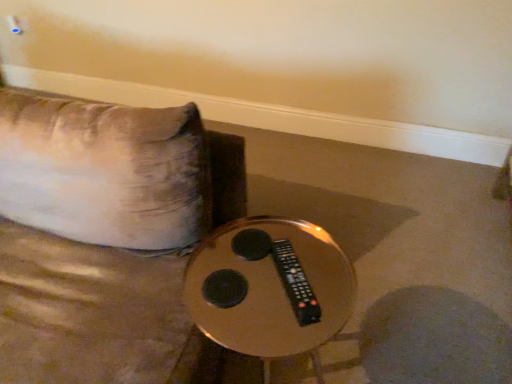
In order to face metallic gold table at center, should I rotate leftwards or rightwards?

Rotate your view right by about 1.647°.

What do you see at coordinates (271, 290) in the screenshot? I see `metallic gold table at center` at bounding box center [271, 290].

Image resolution: width=512 pixels, height=384 pixels. What are the coordinates of `metallic gold table at center` in the screenshot? It's located at (271, 290).

Identify the location of black plastic remote at center. (295, 283).

Describe the element at coordinates (295, 283) in the screenshot. I see `black plastic remote at center` at that location.

Where is `metallic gold table at center`? This screenshot has height=384, width=512. metallic gold table at center is located at coordinates (271, 290).

Which object is positioned more to the right, black plastic remote at center or metallic gold table at center?

black plastic remote at center is more to the right.

Does black plastic remote at center come in front of metallic gold table at center?

No, black plastic remote at center is further to the viewer.

Consider the image. Which is less distant, (291, 253) or (200, 251)?

Point (291, 253) appears to be closer to the viewer than point (200, 251).

From the image's perspective, is black plastic remote at center beneath metallic gold table at center?

No, from the image's perspective, black plastic remote at center is not beneath metallic gold table at center.

From a real-world perspective, is black plastic remote at center below metallic gold table at center?

Actually, black plastic remote at center is physically above metallic gold table at center in the real world.

Considering the sizes of objects black plastic remote at center and metallic gold table at center in the image provided, who is wider, black plastic remote at center or metallic gold table at center?

metallic gold table at center is wider.

Which of these two, black plastic remote at center or metallic gold table at center, stands shorter?

With less height is black plastic remote at center.

Based on their sizes in the image, would you say black plastic remote at center is bigger or smaller than metallic gold table at center?

black plastic remote at center is smaller than metallic gold table at center.

Which is correct: black plastic remote at center is inside metallic gold table at center, or outside of it?

The correct answer is: inside.

Does black plastic remote at center touch metallic gold table at center?

Yes, black plastic remote at center is with metallic gold table at center.

Could you tell me if black plastic remote at center is facing metallic gold table at center?

No.

Measure the distance from black plastic remote at center to metallic gold table at center.

A distance of 3.24 inches exists between black plastic remote at center and metallic gold table at center.

In order to click on remote that appears above the metallic gold table at center (from the image's perspective) in this screenshot , I will do `click(295, 283)`.

Which is more to the right, metallic gold table at center or black plastic remote at center?

black plastic remote at center is more to the right.

Is metallic gold table at center in front of or behind black plastic remote at center in the image?

metallic gold table at center is in front of black plastic remote at center.

Between point (309, 267) and point (276, 245), which one is positioned in front?

The point (309, 267) is closer to the camera.

From the image's perspective, is metallic gold table at center over black plastic remote at center?

Actually, metallic gold table at center appears below black plastic remote at center in the image.

From a real-world perspective, is metallic gold table at center located beneath black plastic remote at center?

Correct, in the physical world, metallic gold table at center is lower than black plastic remote at center.

Looking at their sizes, would you say metallic gold table at center is wider or thinner than black plastic remote at center?

Clearly, metallic gold table at center has more width compared to black plastic remote at center.

Considering the sizes of objects metallic gold table at center and black plastic remote at center in the image provided, who is taller, metallic gold table at center or black plastic remote at center?

Standing taller between the two is metallic gold table at center.

In terms of size, does metallic gold table at center appear bigger or smaller than black plastic remote at center?

Clearly, metallic gold table at center is larger in size than black plastic remote at center.

Which is correct: metallic gold table at center is inside black plastic remote at center, or outside of it?

metallic gold table at center is located beyond the bounds of black plastic remote at center.

Is metallic gold table at center positioned far away from black plastic remote at center?

No, metallic gold table at center is in close proximity to black plastic remote at center.

Is metallic gold table at center facing towards black plastic remote at center?

No, metallic gold table at center is not aimed at black plastic remote at center.

In the image, there is a black plastic remote at center. At what (x,y) coordinates should I click in order to perform the action: click on table below it (from a real-world perspective). Please return your answer as a coordinate pair (x, y). The height and width of the screenshot is (384, 512). Looking at the image, I should click on (271, 290).

Where is `remote positioned vertically above the metallic gold table at center (from a real-world perspective)`? This screenshot has width=512, height=384. remote positioned vertically above the metallic gold table at center (from a real-world perspective) is located at coordinates (295, 283).

Locate an element on the screen. table that is under the black plastic remote at center (from a real-world perspective) is located at coordinates (271, 290).